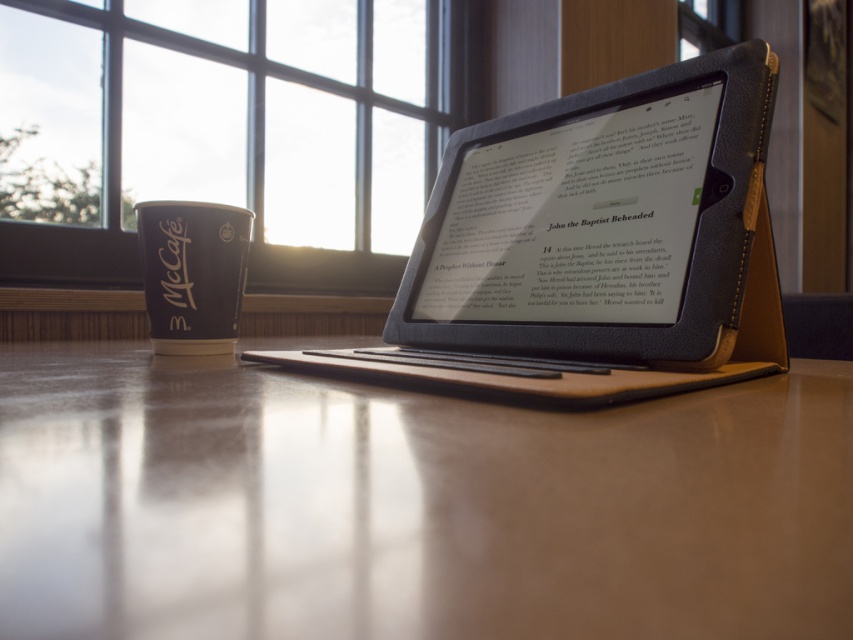
You are sitting at the smooth wooden table at center in a room with a clear glass window at upper center. If you turn your head to the left, will you face the window or away from it?

The smooth wooden table at center is to the right of the clear glass window at upper center. So if you turn your head to the left while sitting at the table, you will face the window.